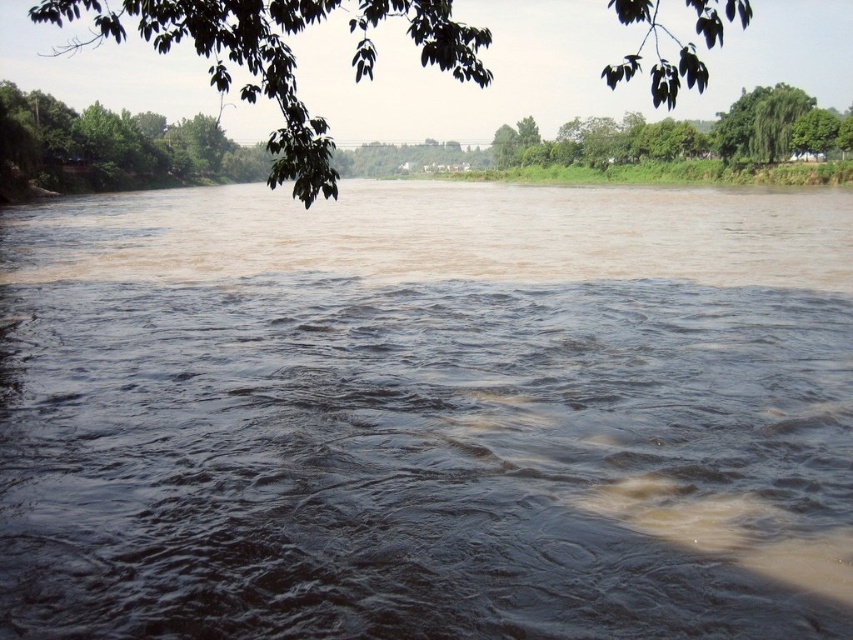
Is brown muddy water at center taller than green leafy tree at upper center?

In fact, brown muddy water at center may be shorter than green leafy tree at upper center.

Identify the location of brown muddy water at center. The height and width of the screenshot is (640, 853). point(427,413).

This screenshot has height=640, width=853. Find the location of `brown muddy water at center`. brown muddy water at center is located at coordinates (427, 413).